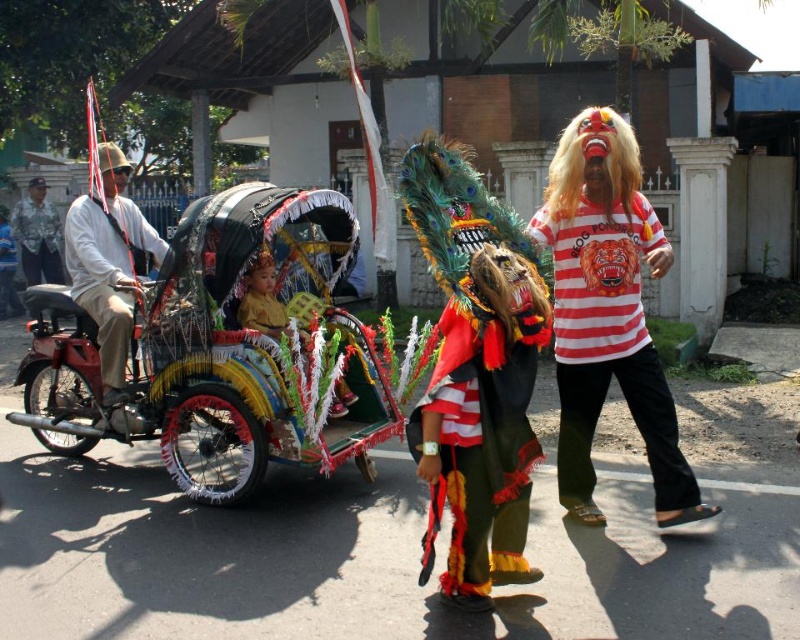
Question: Which of the following is the closest to the observer?

Choices:
 (A) (502, 458)
 (B) (42, 240)

Answer: (A)

Question: Where is striped cotton shirt at center located in relation to red and black fabric dragon at center in the image?

Choices:
 (A) above
 (B) below

Answer: (A)

Question: Can you confirm if striped cotton shirt at center is positioned below red and black fabric dragon at center?

Choices:
 (A) no
 (B) yes

Answer: (A)

Question: Is decorative painted cart at center closer to camera compared to striped cotton shirt at center?

Choices:
 (A) no
 (B) yes

Answer: (A)

Question: Which object is closer to the camera taking this photo?

Choices:
 (A) light brown leather jacket at left
 (B) decorative painted cart at center
 (C) striped cotton shirt at center

Answer: (C)

Question: Considering the real-world distances, which object is farthest from the striped cotton shirt at center?

Choices:
 (A) brushed metal helmet at left
 (B) decorative painted cart at center
 (C) light brown leather jacket at left

Answer: (A)